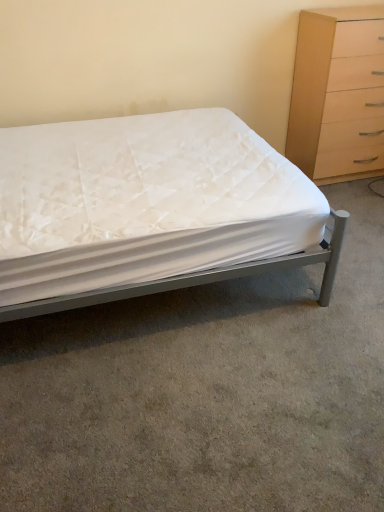
Question: Is light wood/texture chest of drawers at upper right turned away from metallic gray bed at center?

Choices:
 (A) yes
 (B) no

Answer: (B)

Question: Does light wood/texture chest of drawers at upper right have a larger size compared to metallic gray bed at center?

Choices:
 (A) no
 (B) yes

Answer: (A)

Question: Is light wood/texture chest of drawers at upper right oriented towards metallic gray bed at center?

Choices:
 (A) no
 (B) yes

Answer: (A)

Question: Is light wood/texture chest of drawers at upper right directly adjacent to metallic gray bed at center?

Choices:
 (A) no
 (B) yes

Answer: (A)

Question: Can you confirm if light wood/texture chest of drawers at upper right is positioned to the left of metallic gray bed at center?

Choices:
 (A) yes
 (B) no

Answer: (B)

Question: Considering the relative positions of light wood/texture chest of drawers at upper right and metallic gray bed at center in the image provided, is light wood/texture chest of drawers at upper right to the right of metallic gray bed at center from the viewer's perspective?

Choices:
 (A) no
 (B) yes

Answer: (B)

Question: Can you see metallic gray bed at center touching light wood/texture chest of drawers at upper right?

Choices:
 (A) yes
 (B) no

Answer: (B)

Question: Considering the relative sizes of metallic gray bed at center and light wood/texture chest of drawers at upper right in the image provided, is metallic gray bed at center taller than light wood/texture chest of drawers at upper right?

Choices:
 (A) yes
 (B) no

Answer: (B)

Question: Considering the relative sizes of metallic gray bed at center and light wood/texture chest of drawers at upper right in the image provided, is metallic gray bed at center thinner than light wood/texture chest of drawers at upper right?

Choices:
 (A) yes
 (B) no

Answer: (B)

Question: Considering the relative positions of metallic gray bed at center and light wood/texture chest of drawers at upper right in the image provided, is metallic gray bed at center behind light wood/texture chest of drawers at upper right?

Choices:
 (A) yes
 (B) no

Answer: (B)

Question: Considering the relative positions of metallic gray bed at center and light wood/texture chest of drawers at upper right in the image provided, is metallic gray bed at center to the right of light wood/texture chest of drawers at upper right from the viewer's perspective?

Choices:
 (A) no
 (B) yes

Answer: (A)

Question: From a real-world perspective, does metallic gray bed at center sit lower than light wood/texture chest of drawers at upper right?

Choices:
 (A) yes
 (B) no

Answer: (A)

Question: From the image's perspective, is metallic gray bed at center above or below light wood/texture chest of drawers at upper right?

Choices:
 (A) below
 (B) above

Answer: (A)